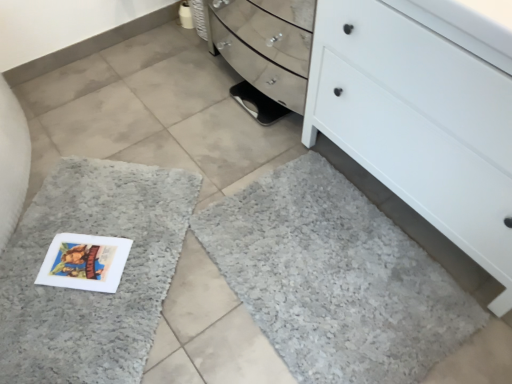
This screenshot has height=384, width=512. I want to click on vacant area on top of gray shaggy bath mat at lower right, the second bath mat when ordered from left to right (from a real-world perspective), so click(x=326, y=264).